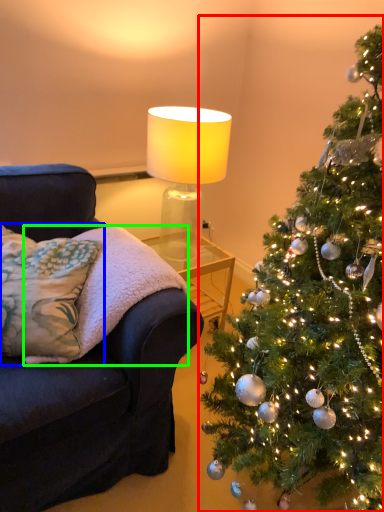
Question: Which object is positioned closest to christmas tree (highlighted by a red box)? Select from pillow (highlighted by a blue box) and blanket (highlighted by a green box).

Choices:
 (A) pillow
 (B) blanket

Answer: (B)